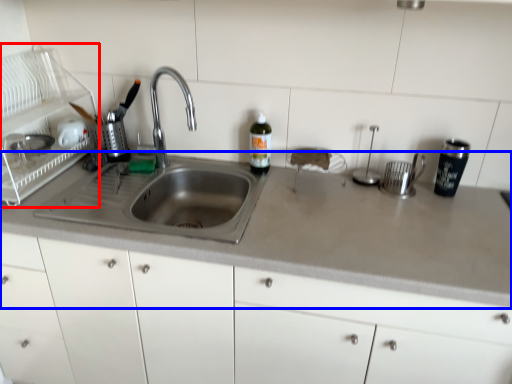
Question: Which of the following is the farthest to the observer, appliance (highlighted by a red box) or countertop (highlighted by a blue box)?

Choices:
 (A) appliance
 (B) countertop

Answer: (A)